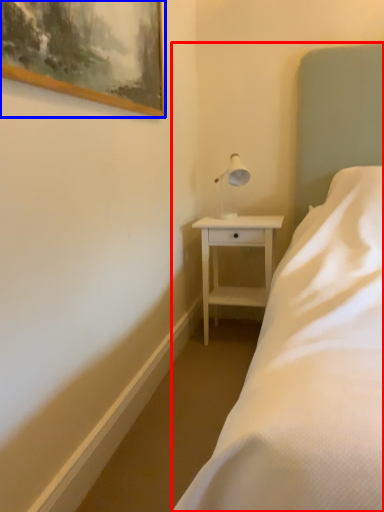
Question: Which of the following is the closest to the observer, bed (highlighted by a red box) or picture frame (highlighted by a blue box)?

Choices:
 (A) bed
 (B) picture frame

Answer: (A)